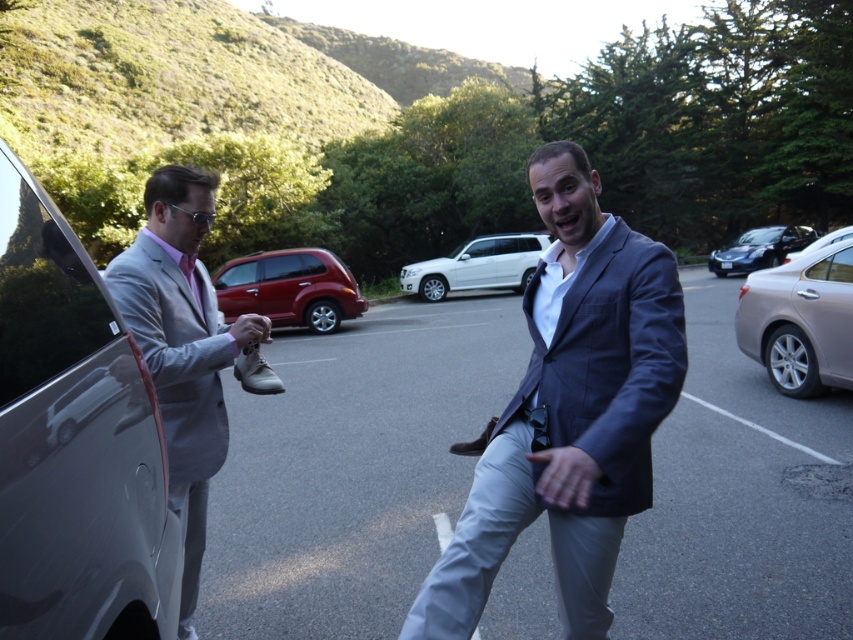
In the scene shown: You are a photographer trying to capture both the matte gray suit at center and the shiny red suv at center in a single frame. Based on their sizes, which object should you focus on first to ensure both are in the frame?

The matte gray suit at center has a larger size compared to the shiny red suv at center, so you should focus on the matte gray suit at center first to ensure both fit within the frame.

You are a delivery person standing at the camera position. You need to place a package in the trunk of the white glossy suv at center. Can you reach the trunk without moving closer than 19 meters?

The white glossy suv at center is 19.27 meters away from camera. Since you need to stay at least 19 meters away, you can just barely reach the trunk as the distance is sufficient.